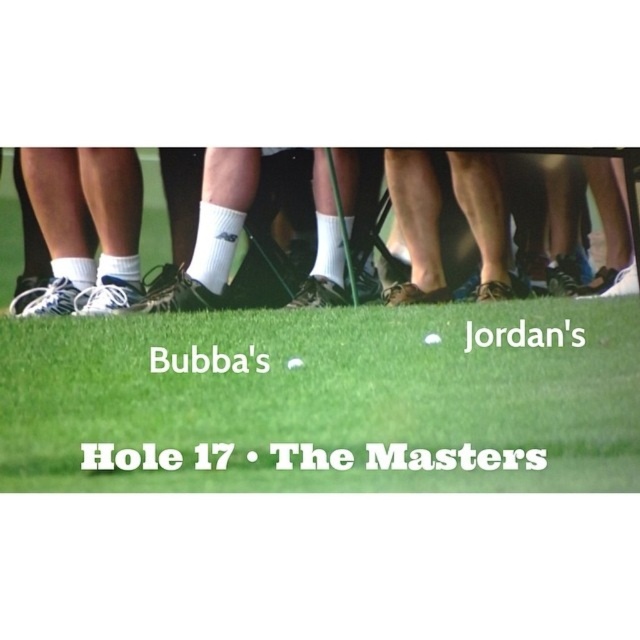
Find the location of a particular element. The image size is (640, 640). white smooth golf ball at center is located at coordinates (324, 401).

Who is more distant from viewer, (538,316) or (298,356)?

The point (538,316) is more distant.

Identify the location of white smooth golf ball at center. Image resolution: width=640 pixels, height=640 pixels. (324, 401).